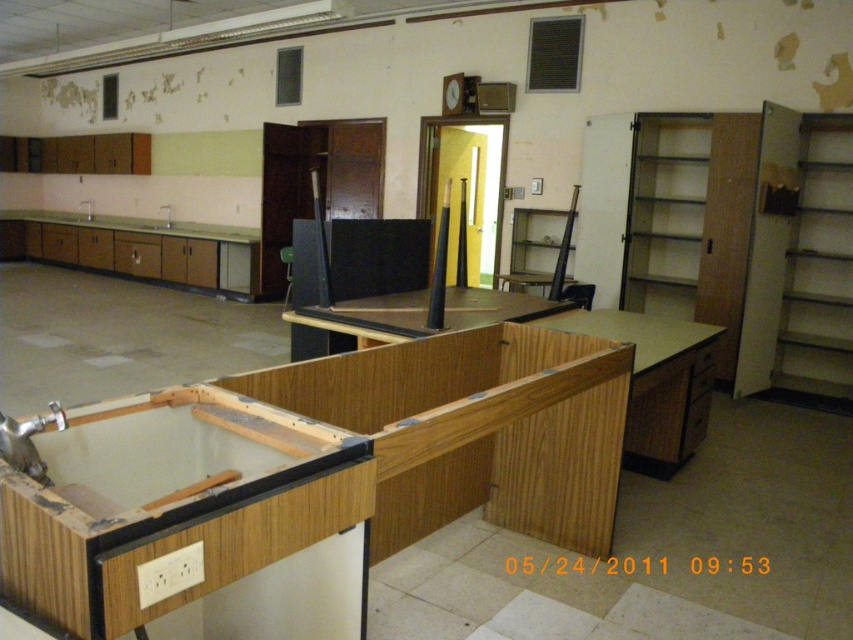
You are a maintenance worker in a lab and you see the white glossy sink at left. Can you reach it from your current position?

The white glossy sink at left is 10.01 meters from camera, so you cannot reach it from your current position.

From the picture: You are a maintenance worker in a building. You need to inspect both the white glossy sink at left and the white glossy sink at lower left. Which one should you check first if you want to start with the one closer to your current position?

You should check the white glossy sink at left first because it is closer to you as it is in front of the white glossy sink at lower left.

You are a plumber inspecting the laboratory and need to determine which sink is shorter. You see the white glossy sink at center and the white glossy sink at lower left. Which one is shorter?

The white glossy sink at center is shorter than the white glossy sink at lower left.